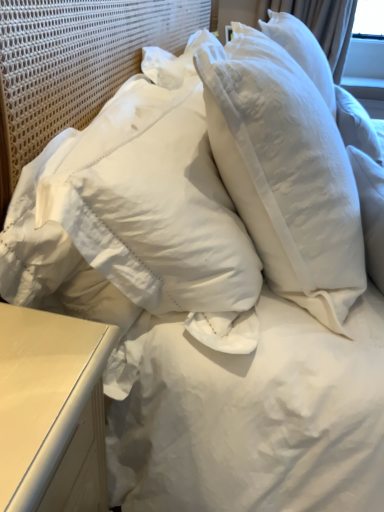
The width and height of the screenshot is (384, 512). Describe the element at coordinates (285, 170) in the screenshot. I see `white soft pillow at upper right` at that location.

At what (x,y) coordinates should I click in order to perform the action: click on white soft pillow at upper right. Please return your answer as a coordinate pair (x, y). The height and width of the screenshot is (512, 384). Looking at the image, I should click on (285, 170).

Locate an element on the screen. The width and height of the screenshot is (384, 512). white soft pillow at upper right is located at coordinates (285, 170).